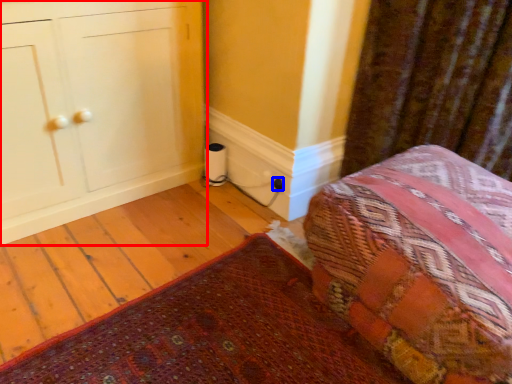
Question: Which point is further to the camera, furniture (highlighted by a red box) or electric outlet (highlighted by a blue box)?

Choices:
 (A) furniture
 (B) electric outlet

Answer: (B)